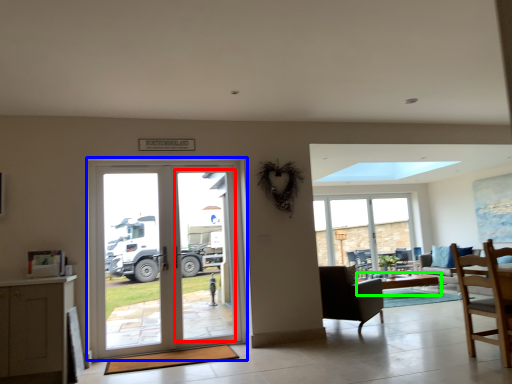
Question: Estimate the real-world distances between objects in this image. Which object is farther from screen door (highlighted by a red box), door (highlighted by a blue box) or table (highlighted by a green box)?

Choices:
 (A) door
 (B) table

Answer: (B)